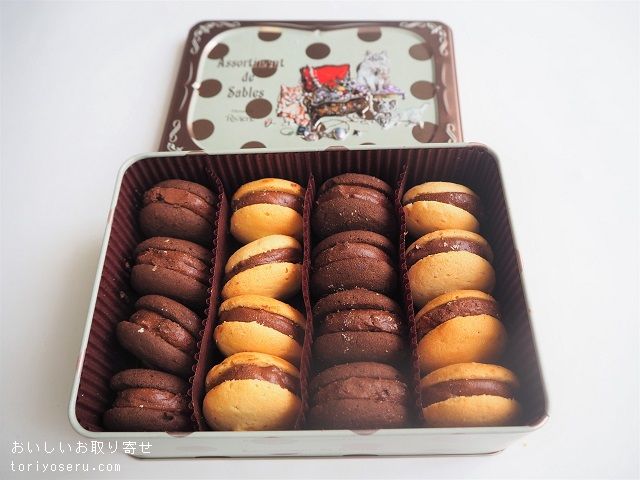
You are a GUI agent. You are given a task and a screenshot of the screen. Output one action in this format:
    pyautogui.click(x=<x>, y=<y>)
    Task: Click on the dividers
    
    Given the screenshot: What is the action you would take?
    (x=406, y=280), (x=310, y=297), (x=214, y=300)